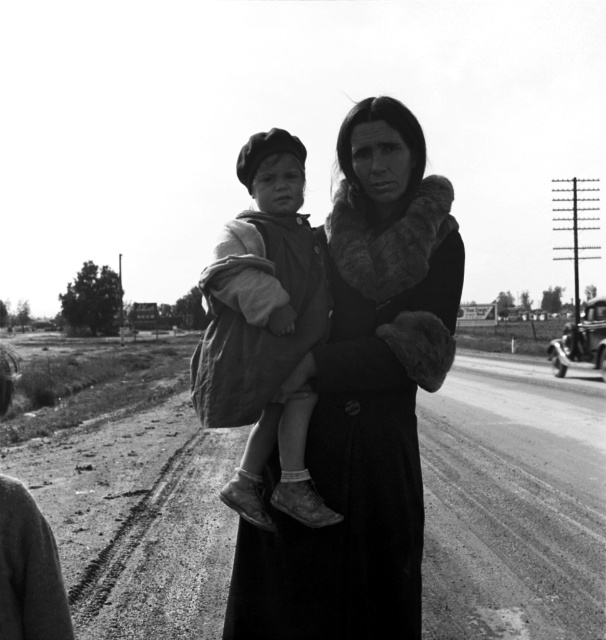
Which is behind, point (588, 525) or point (238, 291)?

The point (588, 525) is behind.

Is dirt track at center wider than ragged fabric child at center?

Correct, the width of dirt track at center exceeds that of ragged fabric child at center.

The width and height of the screenshot is (606, 640). Find the location of `dirt track at center`. dirt track at center is located at coordinates (513, 512).

Is dark fur coat at center wider than ragged fabric child at center?

Yes.

Who is more forward, (327, 592) or (239, 474)?

Positioned in front is point (327, 592).

Is point (325, 445) farther from camera compared to point (255, 314)?

Yes, point (325, 445) is farther from viewer.

The image size is (606, 640). What are the coordinates of `dark fur coat at center` in the screenshot? It's located at (364, 400).

Is the position of dirt track at center less distant than that of dark fur coat at center?

No, it is not.

Does dirt track at center have a larger size compared to dark fur coat at center?

Correct, dirt track at center is larger in size than dark fur coat at center.

Find the location of `dirt track at center`. dirt track at center is located at coordinates click(513, 512).